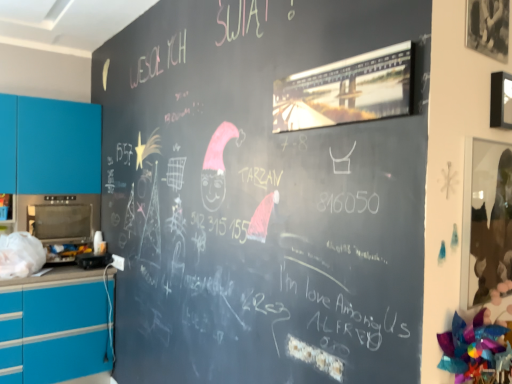
Question: Could you tell me if black plastic toaster at lower left, the second appliance positioned from the left, is facing metallic oven at left, the 2th appliance from the right?

Choices:
 (A) no
 (B) yes

Answer: (A)

Question: Is black plastic toaster at lower left, the second appliance positioned from the left, completely or partially outside of metallic oven at left, the 2th appliance from the right?

Choices:
 (A) no
 (B) yes

Answer: (B)

Question: Does black plastic toaster at lower left, the first appliance positioned from the bottom, come in front of metallic oven at left, the 2th appliance from the right?

Choices:
 (A) no
 (B) yes

Answer: (B)

Question: From a real-world perspective, does black plastic toaster at lower left, the 1th appliance positioned from the right, sit lower than metallic oven at left, which is the 2th appliance from bottom to top?

Choices:
 (A) no
 (B) yes

Answer: (B)

Question: Can you confirm if black plastic toaster at lower left, the 1th appliance positioned from the right, is positioned to the right of metallic oven at left, which is the 2th appliance from bottom to top?

Choices:
 (A) no
 (B) yes

Answer: (B)

Question: Can you confirm if black plastic toaster at lower left, which appears as the 2th appliance when viewed from the top, is positioned to the left of metallic oven at left, the 1th appliance when ordered from left to right?

Choices:
 (A) no
 (B) yes

Answer: (A)

Question: Does matte blue cabinet at left turn towards black plastic toaster at lower left, the second appliance positioned from the left?

Choices:
 (A) no
 (B) yes

Answer: (B)

Question: Is black plastic toaster at lower left, the first appliance positioned from the bottom, at the back of matte blue cabinet at left?

Choices:
 (A) yes
 (B) no

Answer: (B)

Question: Is matte blue cabinet at left in contact with black plastic toaster at lower left, which appears as the 2th appliance when viewed from the top?

Choices:
 (A) yes
 (B) no

Answer: (B)

Question: From the image's perspective, is matte blue cabinet at left on black plastic toaster at lower left, which appears as the 2th appliance when viewed from the top?

Choices:
 (A) no
 (B) yes

Answer: (B)

Question: Is matte blue cabinet at left wider than black plastic toaster at lower left, the 1th appliance positioned from the right?

Choices:
 (A) no
 (B) yes

Answer: (B)

Question: Does matte blue cabinet at left appear on the left side of black plastic toaster at lower left, the 1th appliance positioned from the right?

Choices:
 (A) no
 (B) yes

Answer: (B)

Question: Is black plastic toaster at lower left, the second appliance positioned from the left, looking in the opposite direction of matte blue cabinet at left?

Choices:
 (A) no
 (B) yes

Answer: (A)